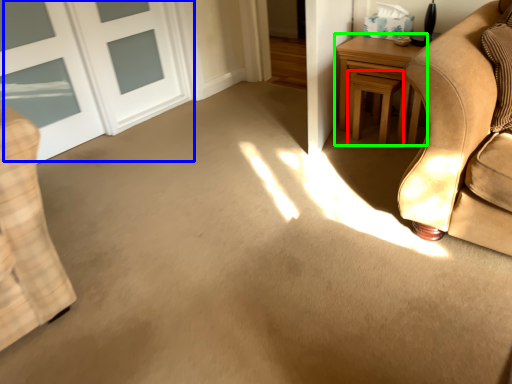
Question: Which object is the farthest from stool (highlighted by a red box)? Choose among these: door (highlighted by a blue box) or table (highlighted by a green box).

Choices:
 (A) door
 (B) table

Answer: (A)